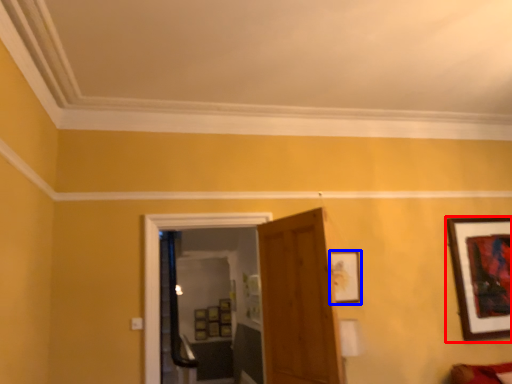
Question: Which point is closer to the camera, picture frame (highlighted by a red box) or picture frame (highlighted by a blue box)?

Choices:
 (A) picture frame
 (B) picture frame

Answer: (B)